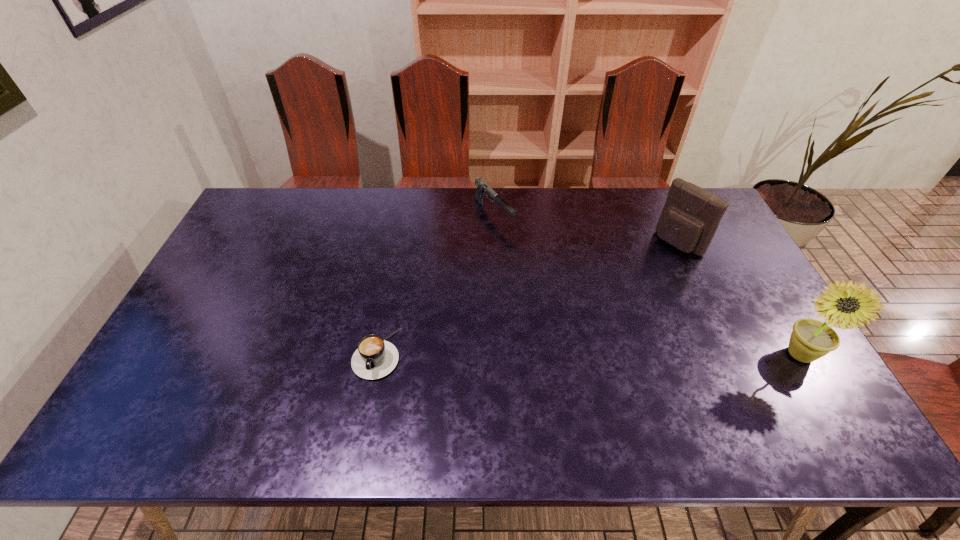
Where is `free spot that satisfies the following two spatial constraints: 1. on the front side of the gun; 2. on the left side of the pouch`? free spot that satisfies the following two spatial constraints: 1. on the front side of the gun; 2. on the left side of the pouch is located at coordinates (495, 243).